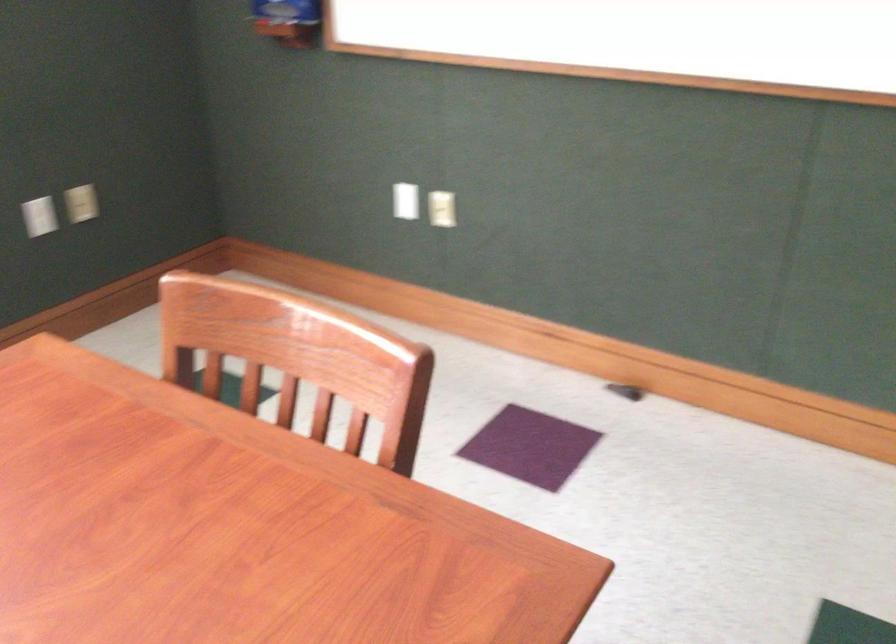
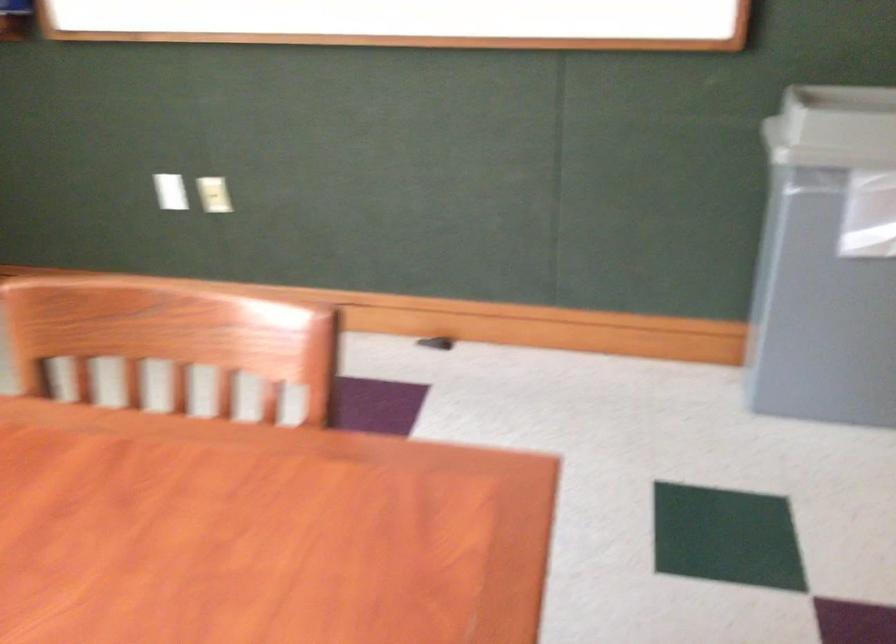
Question: What movement of the cameraman would produce the second image?

Choices:
 (A) Left
 (B) Right
 (C) Forward
 (D) Backward

Answer: (A)